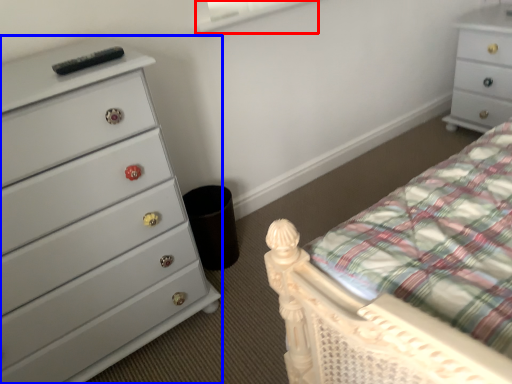
Question: Which object appears farthest to the camera in this image, window screen (highlighted by a red box) or chest of drawers (highlighted by a blue box)?

Choices:
 (A) window screen
 (B) chest of drawers

Answer: (A)